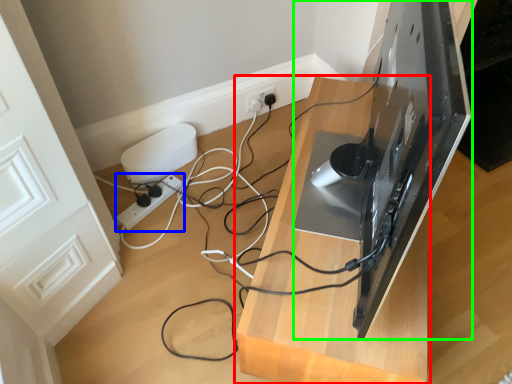
Question: Which is farther away from furniture (highlighted by a red box)? extension cord (highlighted by a blue box) or desktop computer (highlighted by a green box)?

Choices:
 (A) extension cord
 (B) desktop computer

Answer: (A)